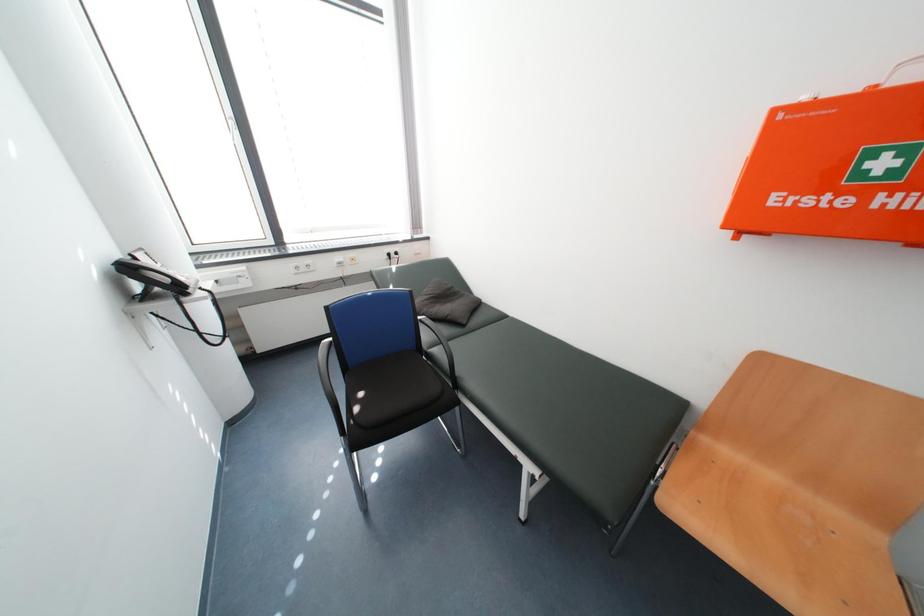
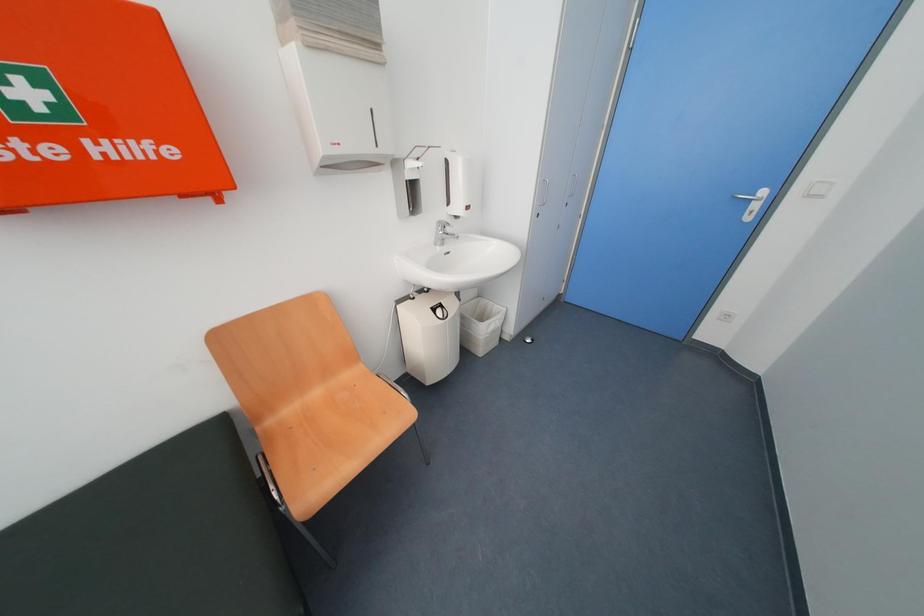
First-person continuous shooting, in which direction is the camera rotating?

The camera's rotation is toward right-down.